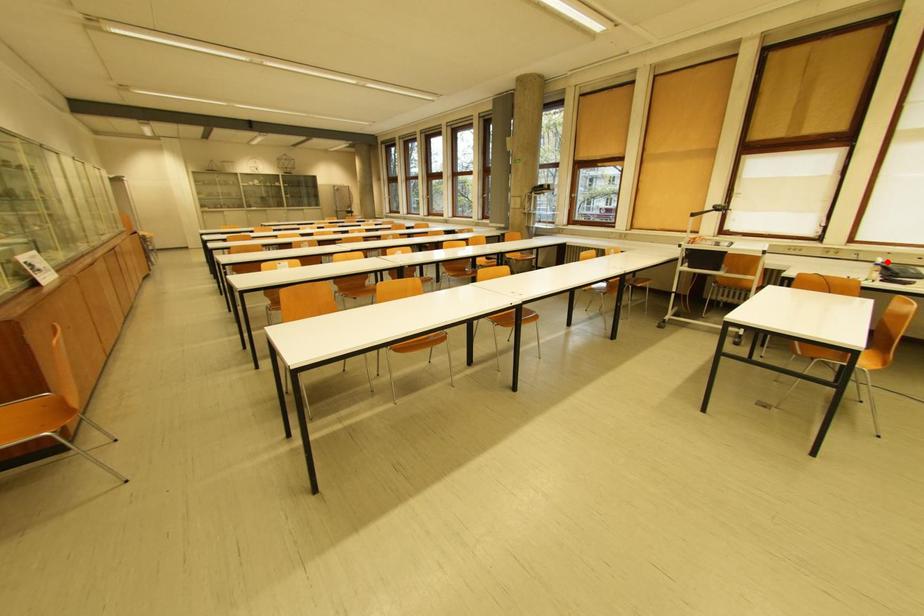
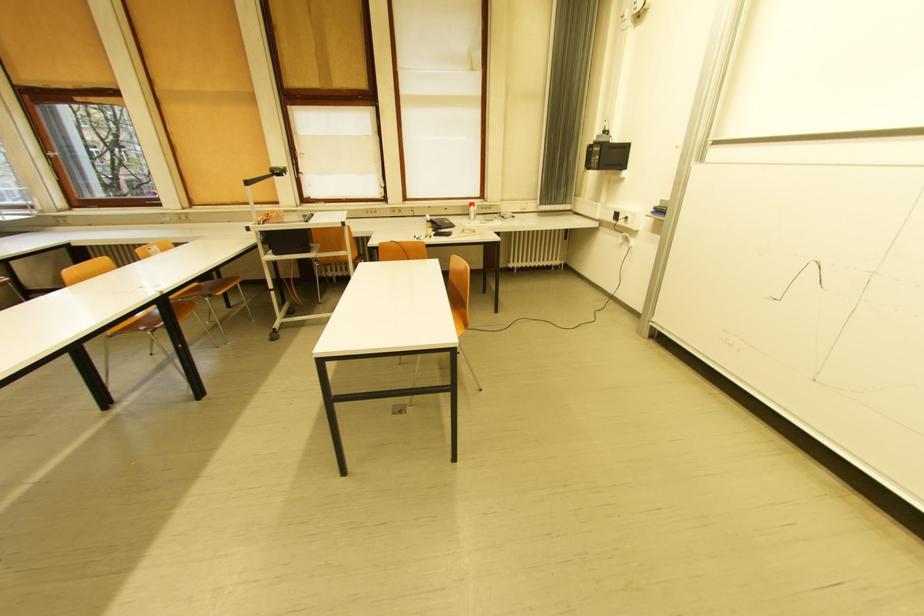
Question: I am providing you with two images of the same scene from different viewpoints. Image1 has a red point marked. In image2, the corresponding 3D location appears at what relative position? Reply with the corresponding letter.

Choices:
 (A) Closer
 (B) Farther

Answer: (A)